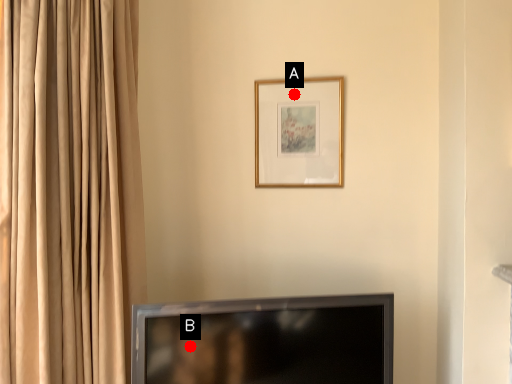
Question: Two points are circled on the image, labeled by A and B beside each circle. Among these points, which one is nearest to the camera?

Choices:
 (A) A is closer
 (B) B is closer

Answer: (B)